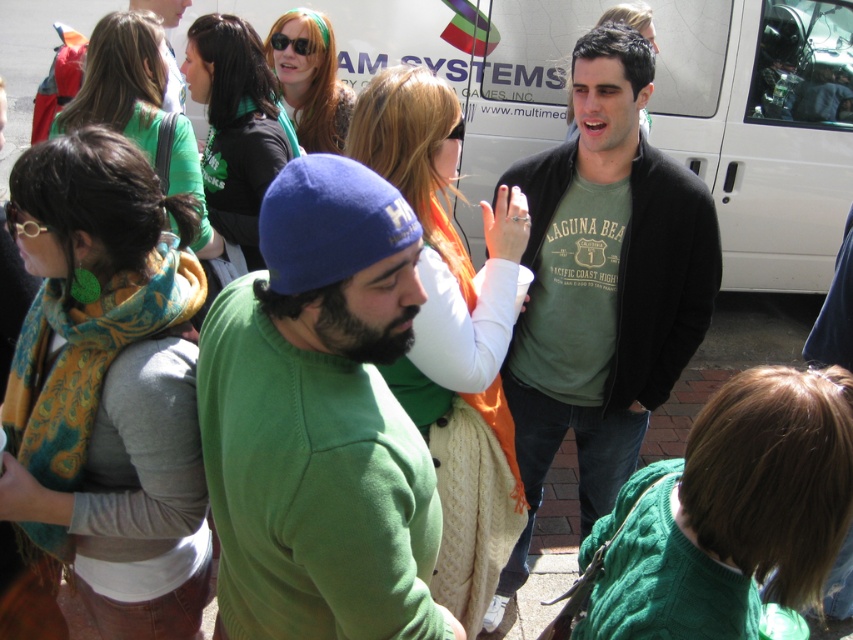
What do you see at coordinates (761, 128) in the screenshot? The height and width of the screenshot is (640, 853). I see `white matte van at upper center` at bounding box center [761, 128].

Is point (795, 141) closer to viewer compared to point (593, 516)?

No.

The width and height of the screenshot is (853, 640). I want to click on white matte van at upper center, so click(x=761, y=128).

Which is above, white matte van at upper center or green matte sweatshirt at center?

white matte van at upper center is higher up.

Locate an element on the screen. white matte van at upper center is located at coordinates (761, 128).

Which of these two, green fleece beanie at center or green cotton t-shirt at center, stands taller?

green cotton t-shirt at center

Between green fleece beanie at center and green cotton t-shirt at center, which one appears on the right side from the viewer's perspective?

From the viewer's perspective, green cotton t-shirt at center appears more on the right side.

Is point (300, 273) behind point (537, 474)?

No.

I want to click on green fleece beanie at center, so click(320, 419).